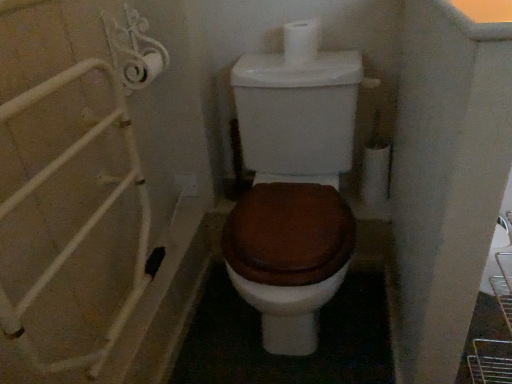
Question: Is brown matte toilet at center wider or thinner than white matte toilet paper at upper center?

Choices:
 (A) wide
 (B) thin

Answer: (A)

Question: From the image's perspective, is brown matte toilet at center positioned above or below white matte toilet paper at upper center?

Choices:
 (A) below
 (B) above

Answer: (A)

Question: Is brown matte toilet at center spatially inside white matte toilet paper at upper center, or outside of it?

Choices:
 (A) inside
 (B) outside

Answer: (B)

Question: Relative to brown matte toilet at center, is white matte toilet paper at upper center in front or behind?

Choices:
 (A) behind
 (B) front

Answer: (A)

Question: In the image, is white matte toilet paper at upper center on the left side or the right side of brown matte toilet at center?

Choices:
 (A) right
 (B) left

Answer: (A)

Question: Does point (297, 56) appear closer or farther from the camera than point (355, 57)?

Choices:
 (A) closer
 (B) farther

Answer: (A)

Question: Considering the positions of white matte toilet paper at upper center and brown matte toilet at center in the image, is white matte toilet paper at upper center bigger or smaller than brown matte toilet at center?

Choices:
 (A) big
 (B) small

Answer: (B)